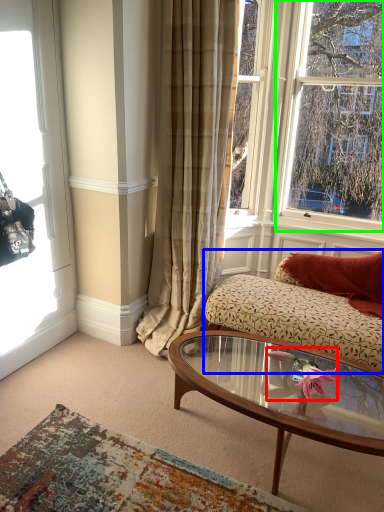
Question: Based on their relative distances, which object is farther from flower (highlighted by a red box)? Choose from studio couch (highlighted by a blue box) and window (highlighted by a green box).

Choices:
 (A) studio couch
 (B) window

Answer: (B)